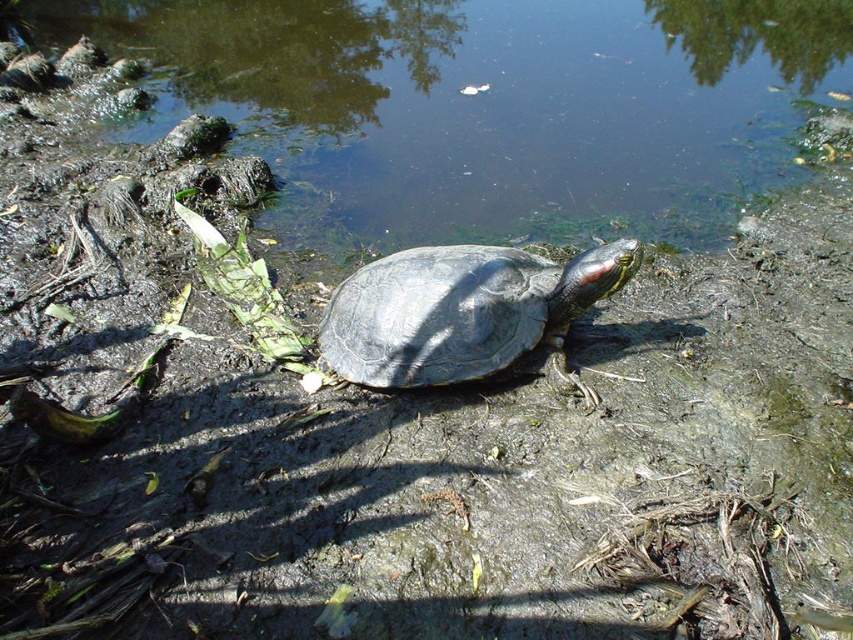
How much distance is there between greenish murky water at center and shiny dark gray tortoise at center?

A distance of 2.14 meters exists between greenish murky water at center and shiny dark gray tortoise at center.

Which is more to the right, greenish murky water at center or shiny dark gray tortoise at center?

shiny dark gray tortoise at center is more to the right.

The height and width of the screenshot is (640, 853). I want to click on greenish murky water at center, so click(x=486, y=106).